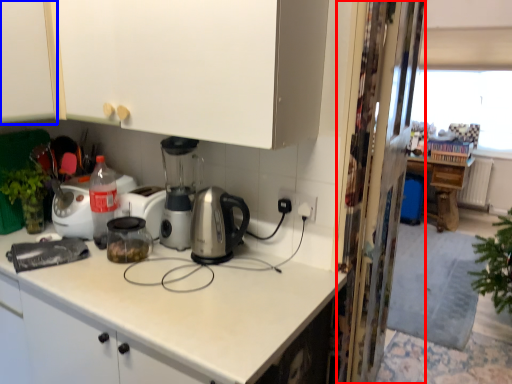
Question: Which point is further to the camera, screen door (highlighted by a red box) or cabinetry (highlighted by a blue box)?

Choices:
 (A) screen door
 (B) cabinetry

Answer: (A)